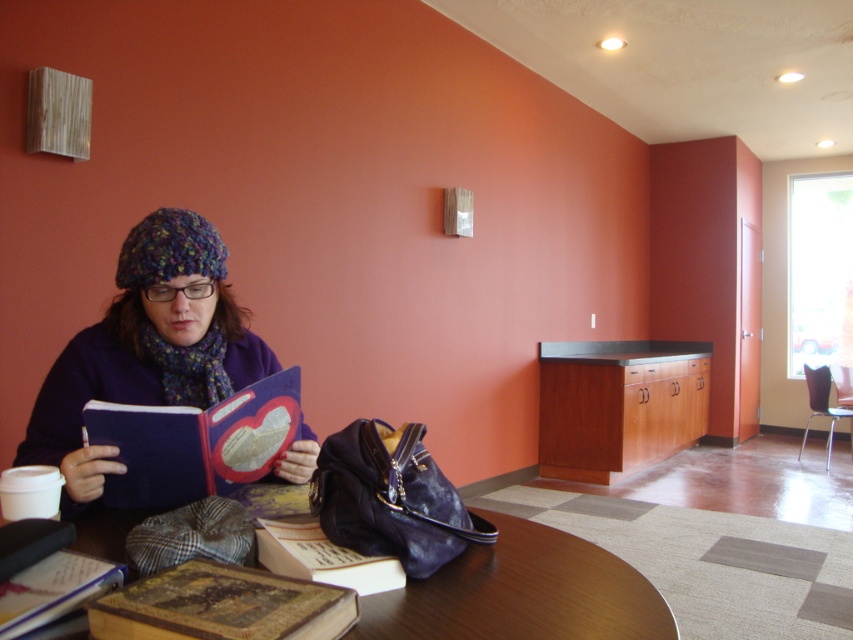
Question: Which object appears farthest from the camera in this image?

Choices:
 (A) knitted woolen hat at left
 (B) hardcover book at center
 (C) leather-bound book at lower left
 (D) matte purple notebook at center

Answer: (A)

Question: Does matte purple notebook at center have a larger size compared to hardcover book at center?

Choices:
 (A) yes
 (B) no

Answer: (A)

Question: Is matte purple notebook at center thinner than hardcover book at center?

Choices:
 (A) yes
 (B) no

Answer: (B)

Question: Estimate the real-world distances between objects in this image. Which object is closer to the hardcover book at center?

Choices:
 (A) wooden table at center
 (B) knitted woolen hat at left

Answer: (A)

Question: From the image, what is the correct spatial relationship of knitted woolen hat at left in relation to hardcover book at lower left?

Choices:
 (A) left
 (B) right

Answer: (A)

Question: Which of the following is the farthest from the observer?

Choices:
 (A) (158, 307)
 (B) (10, 637)
 (C) (260, 538)
 (D) (520, 628)

Answer: (A)